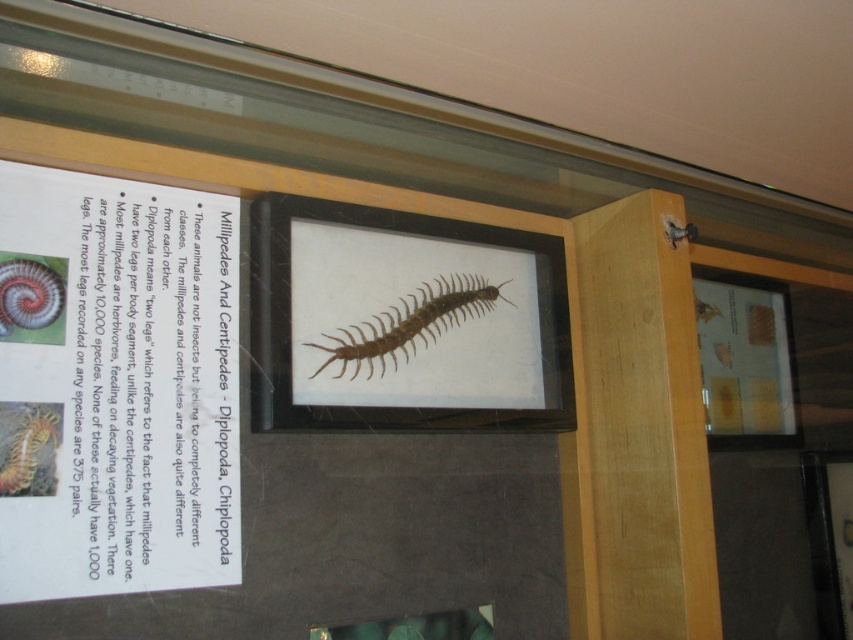
You are a researcher examining the display case and notice a point marked at coordinates (119, 388). Where is this point located relative to the framed illustration of the centipede?

The point is on white paper at upper left relative to the framed illustration of the centipede.

You are a student examining the display case about millipedes and centipedes. You notice the white paper at upper left and the shiny metallic spiral at left. Which object is located to the right of the other?

The white paper at upper left is positioned on the right side of shiny metallic spiral at left, so the white paper at upper left is to the right of the shiny metallic spiral at left.